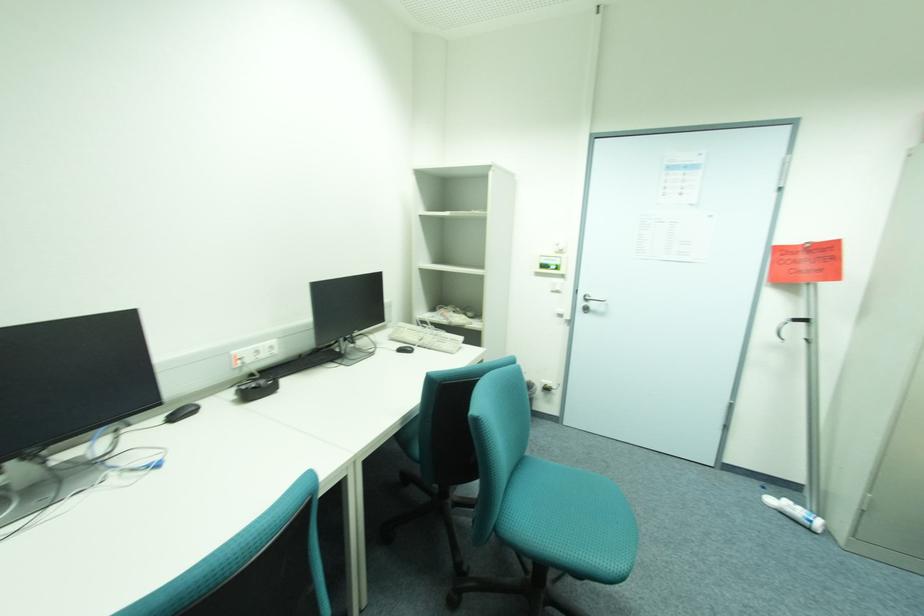
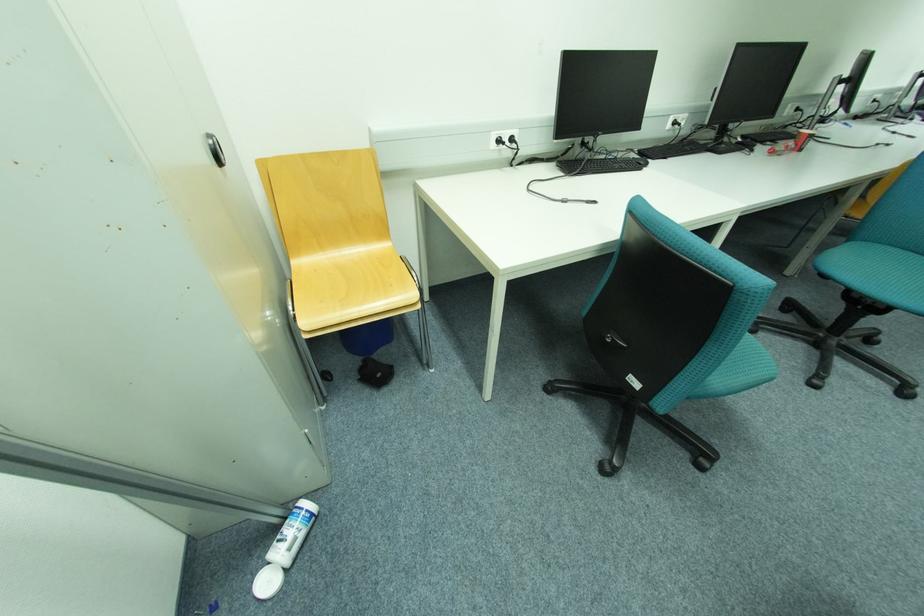
In the second image, find the point that corresponds to point 776,501 in the first image.

(274, 584)